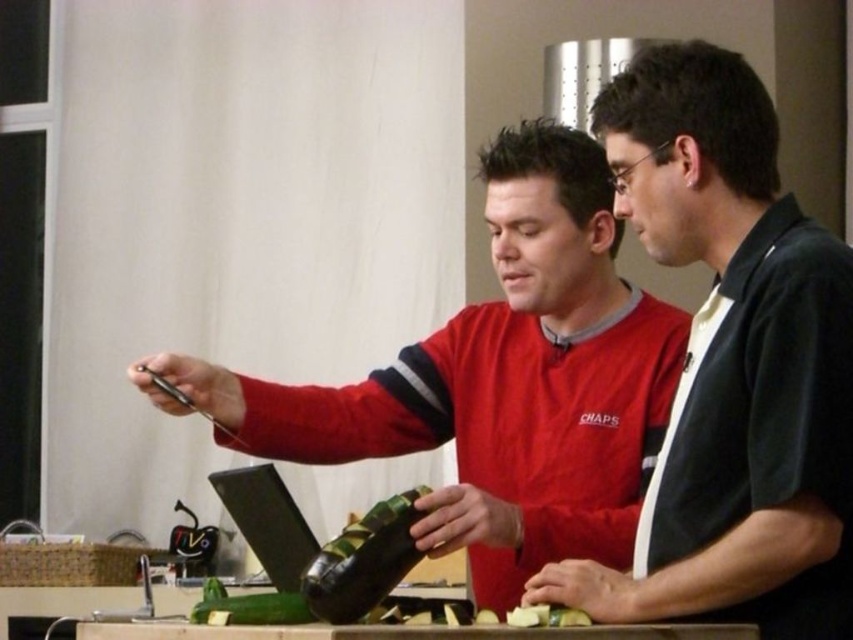
Looking at this image, you are a photographer positioned behind the camera, aiming to capture a clear shot of both the black matte shirt at center and the red fabric shirt at center. Since the camera can only focus on one subject at a time, which subject should you choose to ensure the other remains partially visible but still recognizable?

The black matte shirt at center is in front of the red fabric shirt at center, so you should focus on the black matte shirt at center to ensure the red fabric shirt at center remains partially visible behind it.

You are a photographer trying to capture both the black matte shirt at center and the red fabric shirt at center in a single frame. Based on their heights, which shirt should you position closer to the camera to ensure both are fully visible?

Since the black matte shirt at center is shorter than the red fabric shirt at center, you should position the black matte shirt at center closer to the camera to ensure both are fully visible in the frame.

You are a chef in a kitchen and need to reach both the black matte shirt at center and the green matte bottle at center. Which object should you move first to access the other?

The black matte shirt at center is positioned on the right side of the green matte shirt at center. Therefore, to access the green matte bottle at center first, you should move the black matte shirt at center out of the way.